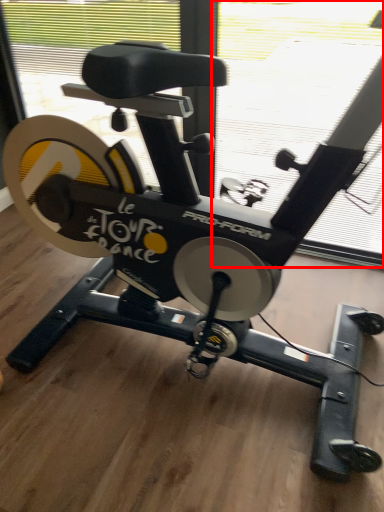
Question: From the image's perspective, where is window screen (annotated by the red box) located relative to window screen?

Choices:
 (A) above
 (B) below

Answer: (A)